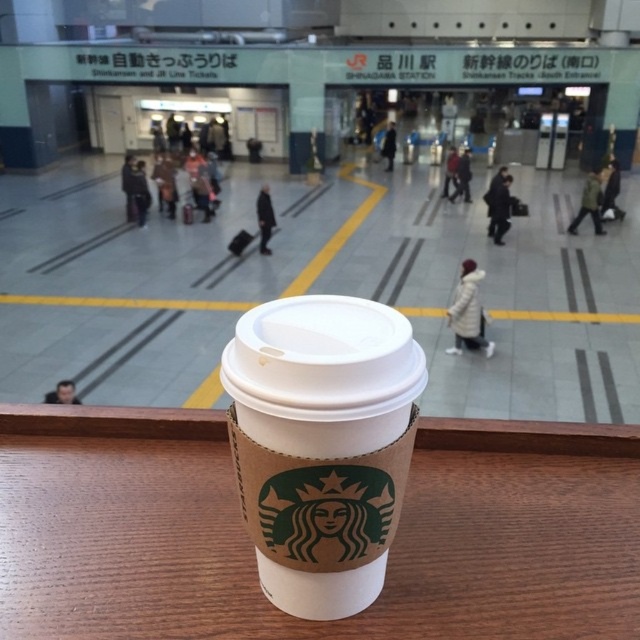
Between wooden table at center and brown paper cup at center, which one has less height?

With less height is wooden table at center.

Looking at this image, which of these two, wooden table at center or brown paper cup at center, stands taller?

With more height is brown paper cup at center.

Which is in front, point (29, 624) or point (358, 438)?

Positioned in front is point (358, 438).

Locate an element on the screen. This screenshot has height=640, width=640. wooden table at center is located at coordinates (252, 548).